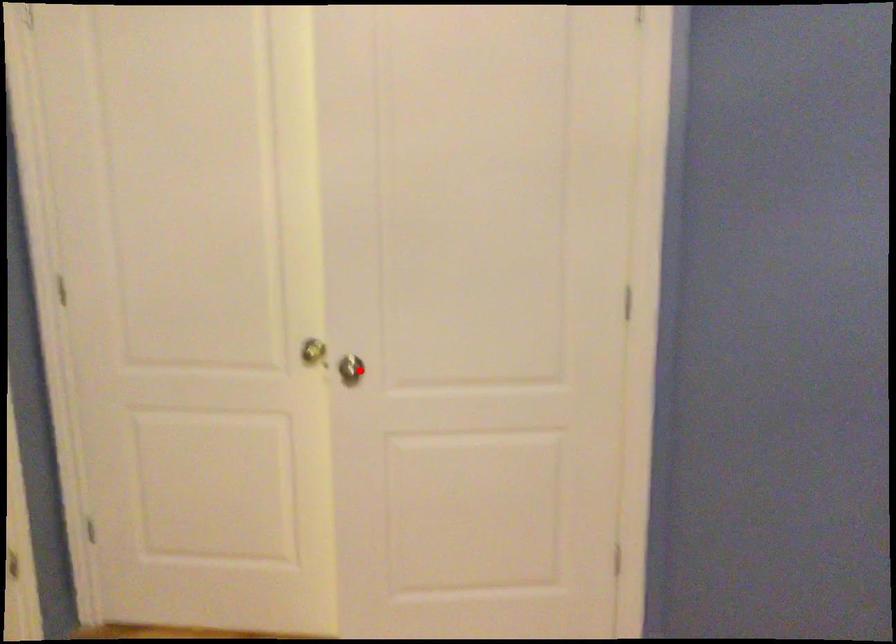
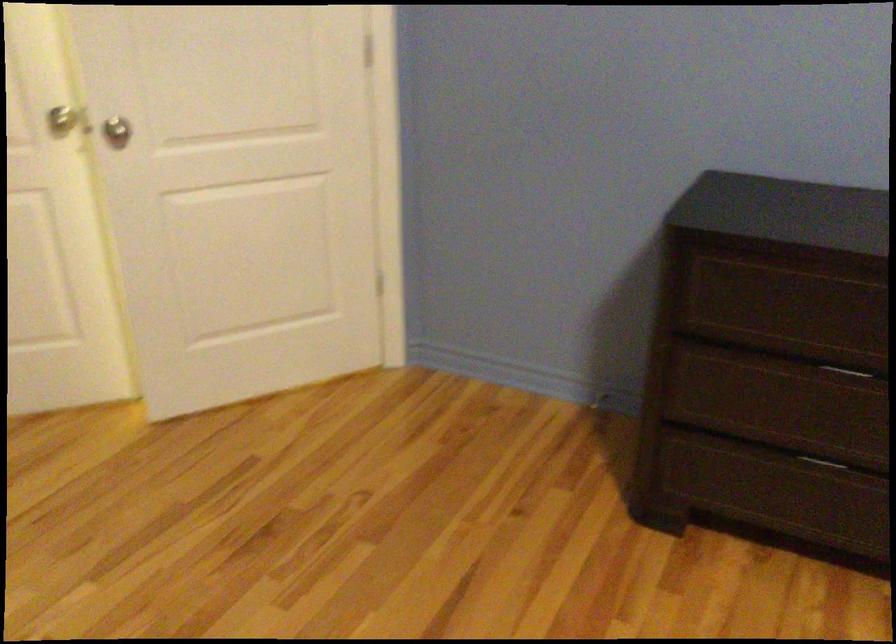
In the second image, find the point that corresponds to the highlighted location in the first image.

(116, 131)